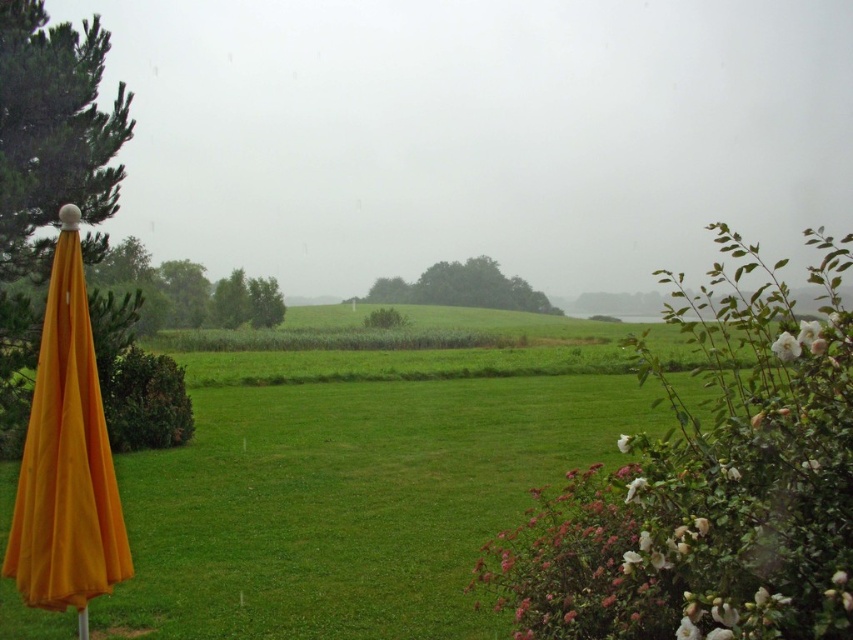
Which is more to the right, orange fabric umbrella at left or white matte flower at lower right?

From the viewer's perspective, white matte flower at lower right appears more on the right side.

Can you confirm if orange fabric umbrella at left is positioned above white matte flower at lower right?

Correct, orange fabric umbrella at left is located above white matte flower at lower right.

The image size is (853, 640). Find the location of `orange fabric umbrella at left`. orange fabric umbrella at left is located at coordinates (67, 458).

Image resolution: width=853 pixels, height=640 pixels. What are the coordinates of `orange fabric umbrella at left` in the screenshot? It's located at (67, 458).

The height and width of the screenshot is (640, 853). Describe the element at coordinates (67, 458) in the screenshot. I see `orange fabric umbrella at left` at that location.

Is orange fabric umbrella at left below white matte flower at upper right?

Yes, orange fabric umbrella at left is below white matte flower at upper right.

In order to click on orange fabric umbrella at left in this screenshot , I will do `click(67, 458)`.

Which is above, white matte flower at upper right or white matte flower at lower right?

white matte flower at upper right is higher up.

What do you see at coordinates (786, 346) in the screenshot?
I see `white matte flower at upper right` at bounding box center [786, 346].

Find the location of a particular element. The width and height of the screenshot is (853, 640). white matte flower at upper right is located at coordinates coord(786,346).